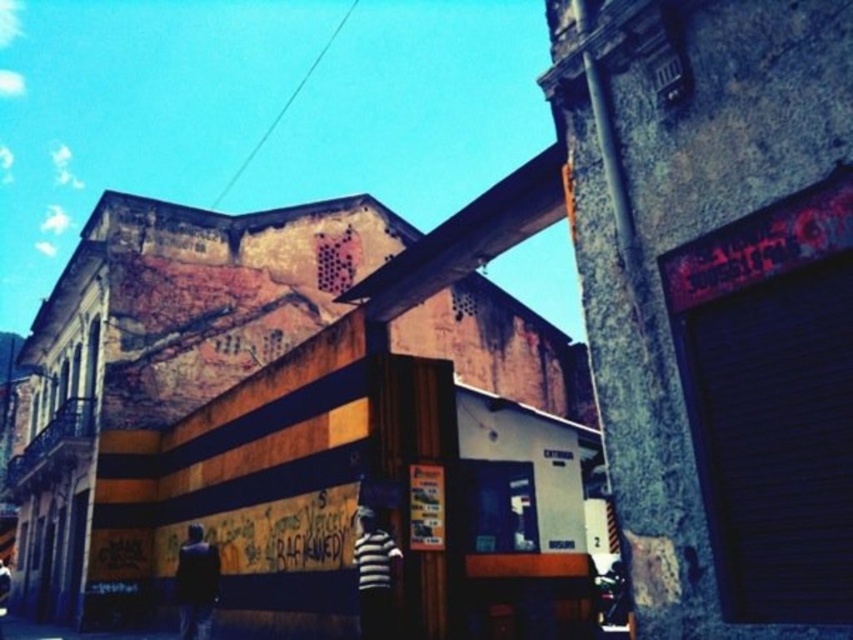
You are standing at the point where the shadow from the overhang ends. You see the point marked as point (x=373, y=576). Is this point in the shadow area?

The point (x=373, y=576) is in the shadow area because the shadow from the overhang covers that location.

You are standing in front of the building and see both the striped shirt at center and the dark fabric jacket at lower left. Which clothing item is positioned more to the right side of the scene?

The striped shirt at center is positioned more to the right side of the scene compared to the dark fabric jacket at lower left.